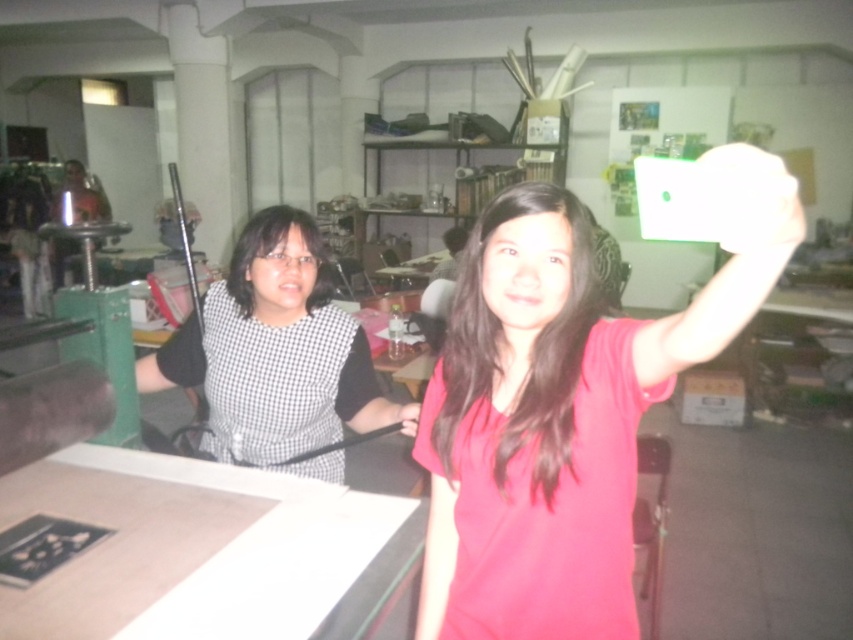
Does matte red shirt at center appear under black checkered dress at left?

Yes.

Which is more to the left, matte red shirt at center or black checkered dress at left?

black checkered dress at left is more to the left.

Is point (413, 449) positioned after point (341, 420)?

No, it is in front of (341, 420).

This screenshot has width=853, height=640. What are the coordinates of `matte red shirt at center` in the screenshot? It's located at (561, 417).